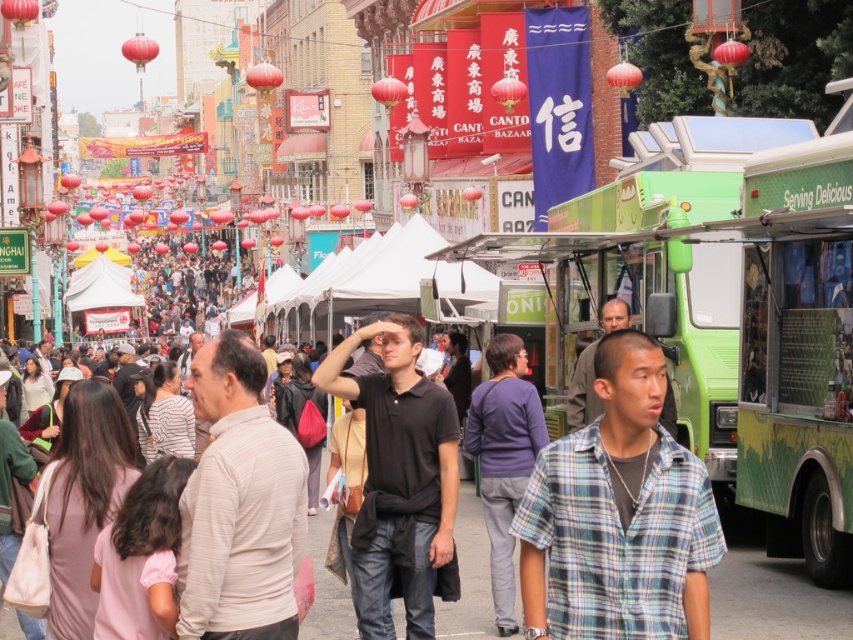
Question: Observing the image, what is the correct spatial positioning of green matte food truck at center in reference to crowd at center?

Choices:
 (A) right
 (B) left

Answer: (A)

Question: Based on their relative distances, which object is nearer to the black matte shirt at center?

Choices:
 (A) light beige striped shirt at center
 (B) crowd at center
 (C) green matte food truck at center
 (D) plaid cotton shirt at center

Answer: (A)

Question: Can you confirm if black matte shirt at center is bigger than crowd at center?

Choices:
 (A) no
 (B) yes

Answer: (A)

Question: Can you confirm if light beige striped shirt at center is smaller than black matte shirt at center?

Choices:
 (A) no
 (B) yes

Answer: (A)

Question: Which point is farther to the camera?

Choices:
 (A) (634, 634)
 (B) (421, 348)
 (C) (537, 406)

Answer: (C)

Question: Which object appears closest to the camera in this image?

Choices:
 (A) green matte food truck at center
 (B) purple cotton sweater at center
 (C) crowd at center

Answer: (A)